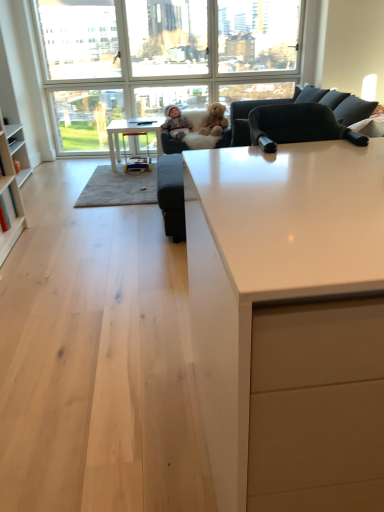
Question: From the image's perspective, is clear glass window at upper center beneath wooden stool at center?

Choices:
 (A) yes
 (B) no

Answer: (B)

Question: Is clear glass window at upper center behind wooden stool at center?

Choices:
 (A) yes
 (B) no

Answer: (B)

Question: Is clear glass window at upper center completely or partially outside of wooden stool at center?

Choices:
 (A) yes
 (B) no

Answer: (A)

Question: Is clear glass window at upper center shorter than wooden stool at center?

Choices:
 (A) yes
 (B) no

Answer: (B)

Question: Is clear glass window at upper center at the left side of wooden stool at center?

Choices:
 (A) no
 (B) yes

Answer: (A)

Question: From a real-world perspective, is clear glass window at upper center physically above wooden stool at center?

Choices:
 (A) yes
 (B) no

Answer: (A)

Question: Does white glossy table at center have a smaller size compared to fluffy beige teddy bear at center?

Choices:
 (A) no
 (B) yes

Answer: (A)

Question: Is white glossy table at center wider than fluffy beige teddy bear at center?

Choices:
 (A) no
 (B) yes

Answer: (B)

Question: Can you confirm if white glossy table at center is shorter than fluffy beige teddy bear at center?

Choices:
 (A) yes
 (B) no

Answer: (B)

Question: From the image's perspective, would you say white glossy table at center is shown under fluffy beige teddy bear at center?

Choices:
 (A) yes
 (B) no

Answer: (A)

Question: Is white glossy table at center oriented away from fluffy beige teddy bear at center?

Choices:
 (A) yes
 (B) no

Answer: (B)

Question: Is white glossy table at center not inside fluffy beige teddy bear at center?

Choices:
 (A) yes
 (B) no

Answer: (A)

Question: From a real-world perspective, does wooden stool at center sit lower than white glossy table at center?

Choices:
 (A) no
 (B) yes

Answer: (B)